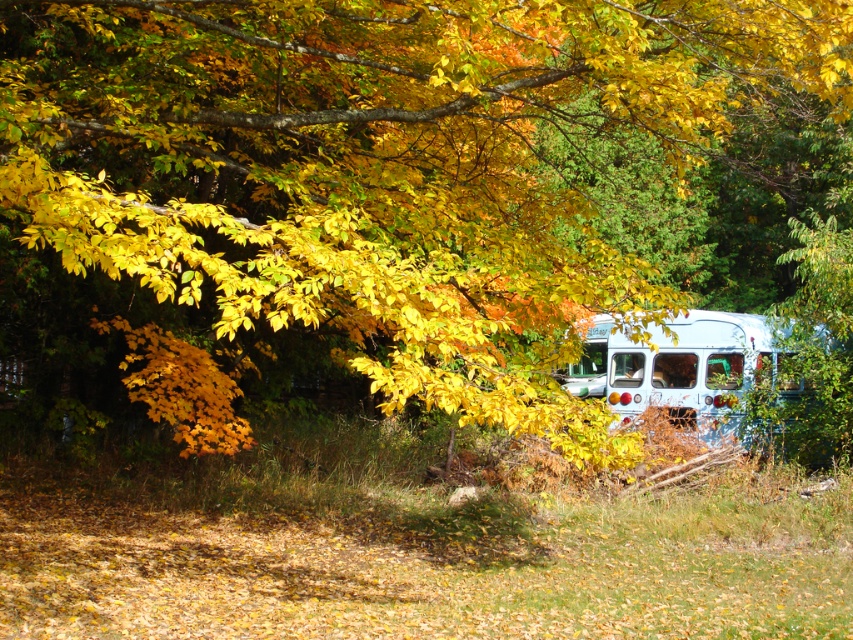
Which of these two, yellow matte leaves at upper center or white matte school bus at right, stands taller?

yellow matte leaves at upper center is taller.

Does yellow matte leaves at upper center have a larger size compared to white matte school bus at right?

Yes.

Where is `yellow matte leaves at upper center`? Image resolution: width=853 pixels, height=640 pixels. yellow matte leaves at upper center is located at coordinates (376, 179).